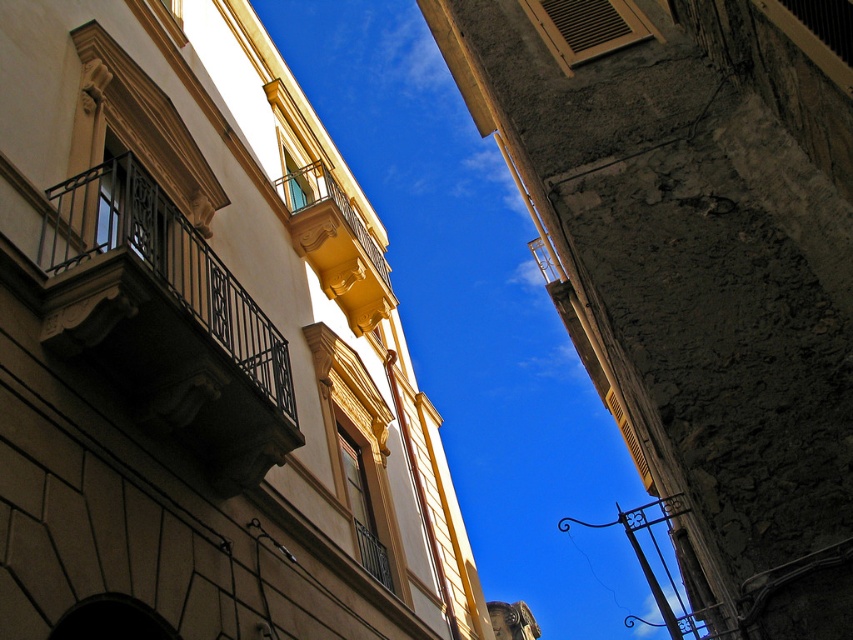
You are standing on the street looking up. You see the rough concrete wall at upper right and the black wrought iron balcony at left. Which object is closer to you?

The rough concrete wall at upper right is closer to you because it is in front of the black wrought iron balcony at left.

Based on the photo, you are an architect analyzing the structural stability of the buildings in the image. Given that the rough concrete wall at upper right is larger in size than the black wrought iron balcony at left, which object might require more reinforcement to support its weight?

The rough concrete wall at upper right might require more reinforcement because it is larger in size than the black wrought iron balcony at left, making it potentially heavier and needing stronger support.